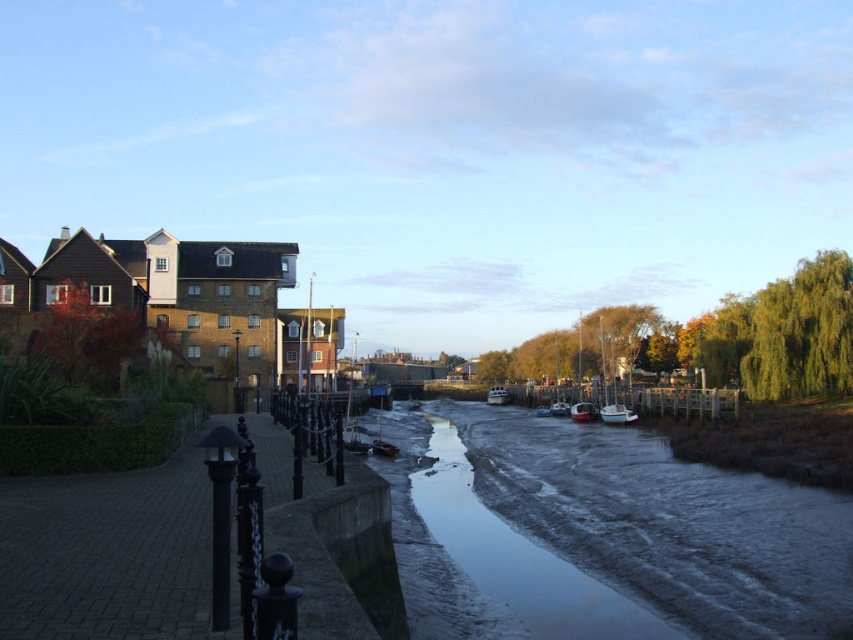
Question: Does white matte boat at center appear over wooden boat at center?

Choices:
 (A) yes
 (B) no

Answer: (B)

Question: Is white matte boat at center smaller than white glossy boat at center?

Choices:
 (A) yes
 (B) no

Answer: (A)

Question: Among these points, which one is farthest from the camera?

Choices:
 (A) (505, 396)
 (B) (592, 417)
 (C) (569, 413)

Answer: (A)

Question: Can you confirm if white matte boat at center is positioned to the right of blue glossy boat at center?

Choices:
 (A) no
 (B) yes

Answer: (B)

Question: Which point is farther to the camera?

Choices:
 (A) (381, 451)
 (B) (619, 420)
 (C) (492, 387)

Answer: (C)

Question: Which object appears closest to the camera in this image?

Choices:
 (A) wooden boat at center
 (B) metallic silver boat at center
 (C) blue glossy boat at center
 (D) white glossy boat at center

Answer: (A)